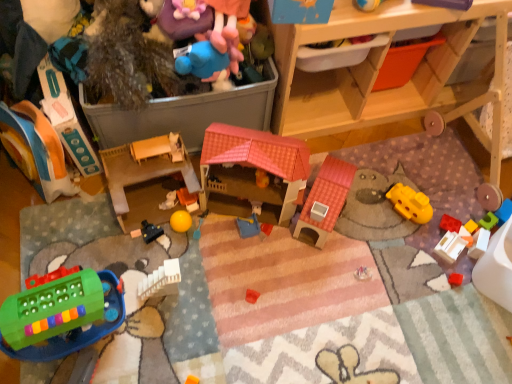
Locate an element on the screen. The height and width of the screenshot is (384, 512). vacant region to the right of smooth plastic toy at center, arranged as the 5th toy when viewed from the left is located at coordinates (216, 216).